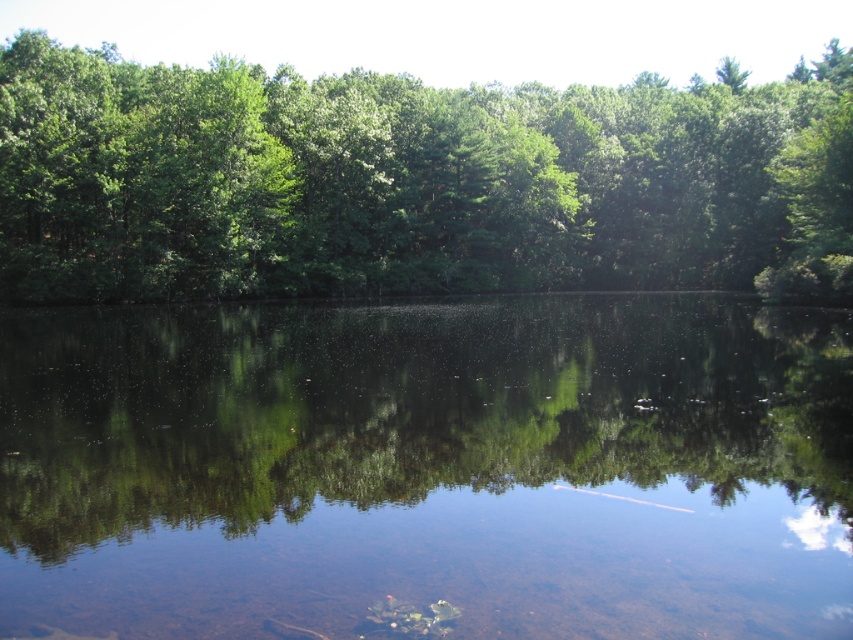
Question: Which point appears farthest from the camera in this image?

Choices:
 (A) (527, 259)
 (B) (155, 595)

Answer: (A)

Question: Does clear water at center have a smaller size compared to green leafy trees at upper center?

Choices:
 (A) no
 (B) yes

Answer: (B)

Question: Does clear water at center appear on the right side of green leafy trees at upper center?

Choices:
 (A) no
 (B) yes

Answer: (B)

Question: Considering the relative positions of clear water at center and green leafy trees at upper center in the image provided, where is clear water at center located with respect to green leafy trees at upper center?

Choices:
 (A) left
 (B) right

Answer: (B)